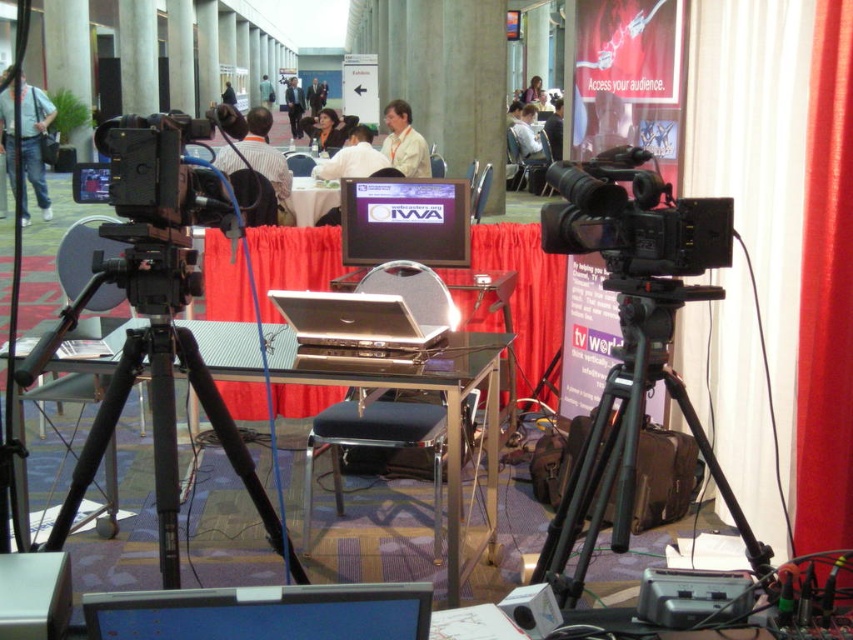
You are a stagehand setting up for a live event. You need to place a microphone stand between the red velvet curtain at center and the light brown leather jacket at center. Based on their positions, which object should the microphone stand be closer to?

The microphone stand should be closer to the light brown leather jacket at center because the red velvet curtain at center is positioned on the right side of the light brown leather jacket at center, meaning the jacket is to the left of the curtain. Therefore, placing the microphone stand between them would require it to be closer to the jacket on the left side.

Looking at this image, you are a stagehand preparing for a live event. You need to hang a banner that requires at least 2 meters of vertical space. Looking at the scene, can the red velvet curtain at center and the light brown leather jacket at center provide enough vertical clearance for the banner?

The red velvet curtain at center has a lesser height compared to light brown leather jacket at center. Since the jacket is taller, it might not provide sufficient vertical clearance for the banner requiring 2 meters. Check the actual height of the jacket to confirm.

You are a technician setting up for a live stream. You need to adjust the height of the black leather stool at center so that it matches the height of the white shirt at center. Is the stool currently too high or too low?

The black leather stool at center is shorter than the white shirt at center, so it is currently too low and needs to be raised to match the height of the white shirt at center.